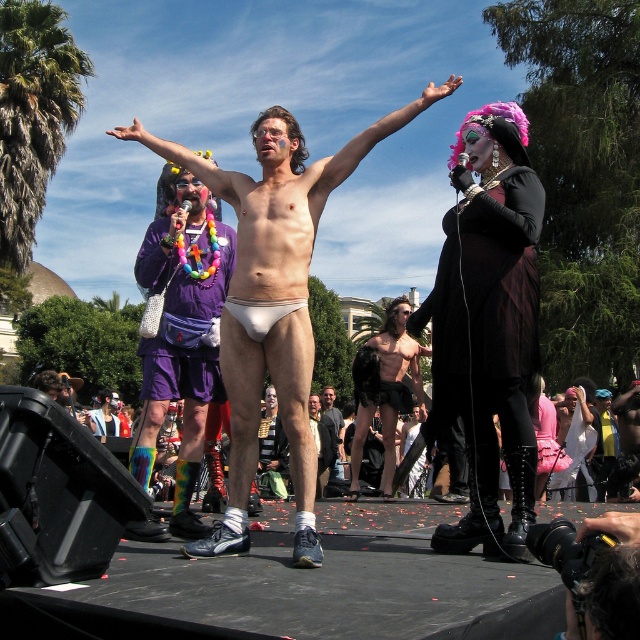
You are a stagehand preparing to place a new spotlight on the stage. The spotlight has a beam width of 30 cm. Based on the description, can the spotlight illuminate both the black leather dress at center and the smooth black shorts at center simultaneously without moving the spotlight?

The black leather dress at center might be wider than smooth black shorts at center. Since the spotlight has a beam width of 30 cm, if the combined width of both items exceeds 30 cm, they won not fit. However, the exact width difference isn known, so it cannot be determined for certain.

From the picture: You are a photographer at the event and want to capture a clear photo of both the black leather dress at center and the smooth black shorts at center. Which object should you focus on first to ensure both are in focus?

The black leather dress at center is closer to the viewer than the smooth black shorts at center. To ensure both are in focus, you should focus on the black leather dress at center first, as it is closer, and the shorts will be in the background depth of field.

Based on the scene description, which object is positioned higher in the image? The white matte underwear at center or the purple fabric shorts at left?

The white matte underwear at center is positioned higher than the purple fabric shorts at left according to the description.